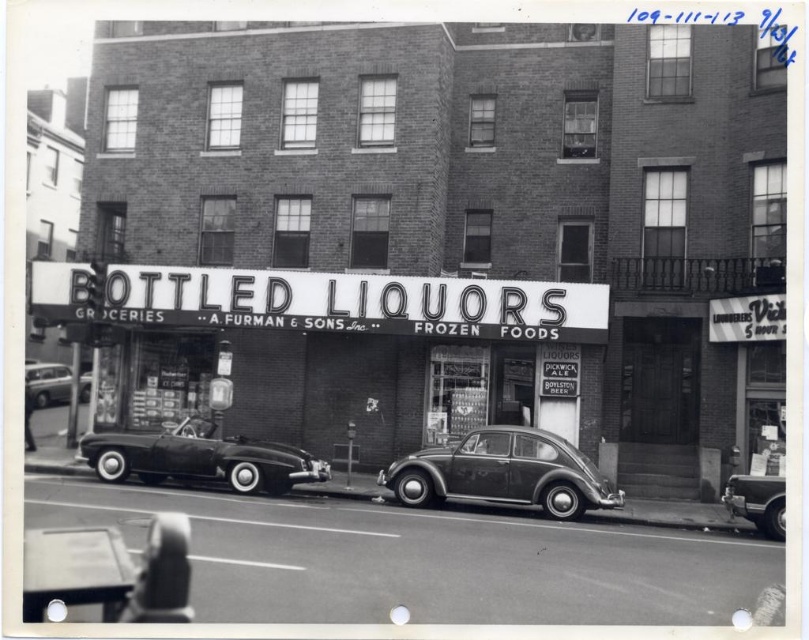
You are a delivery person needing to park a 2.5 meter wide delivery van between the matte gray car at center and the shiny black convertible at center. Is there enough space between them for your van?

The distance between the matte gray car at center and the shiny black convertible at center is 3.27 meters. Since the van is 2.5 meters wide, there is enough space between them for the van to fit.

You are a delivery person trying to park your 2.5 meters tall delivery van in this street scene. You see the shiny black convertible at center and the shiny silver sedan at left. Which vehicle should you avoid parking next to to ensure your van can pass through without hitting the overhead street lights?

The shiny black convertible at center has a lesser height compared to the shiny silver sedan at left. Since the van is 2.5 meters tall, you should avoid parking next to the taller shiny silver sedan at left to ensure clearance under the overhead street lights.

You are a pedestrian standing on the sidewalk looking at the street in front of the liquor store. There is a matte gray car at center and a shiny black convertible at center. Which car is closer to you?

The matte gray car at center is closer to you because it is in front of the shiny black convertible at center.